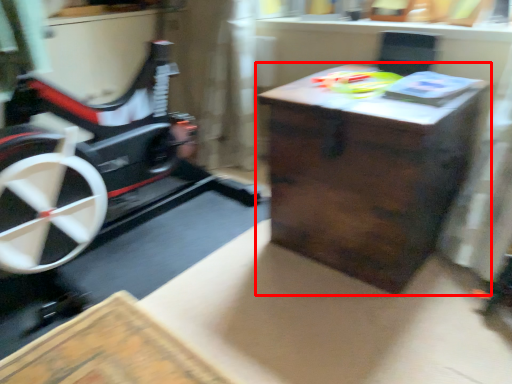
Question: From the image's perspective, where is table (annotated by the red box) located relative to toy?

Choices:
 (A) below
 (B) above

Answer: (A)